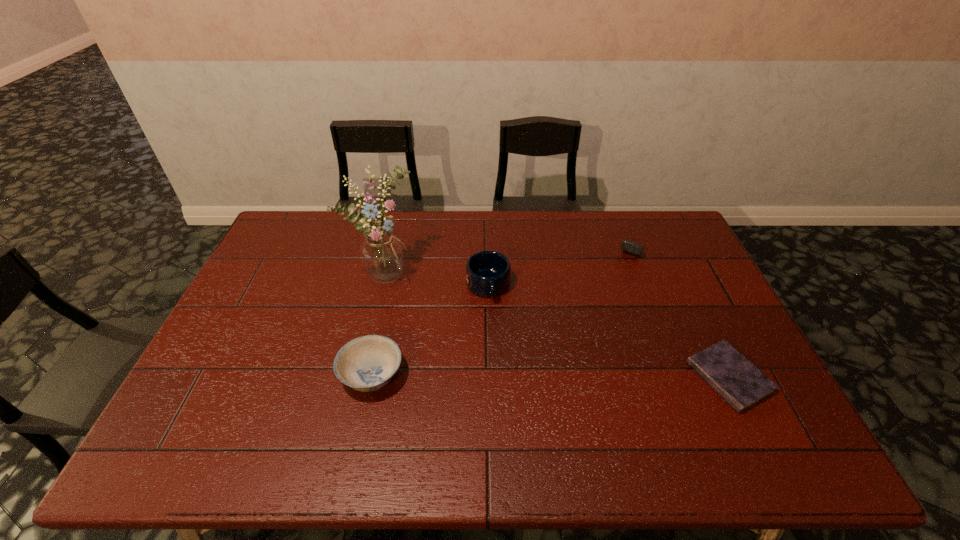
I want to click on diary present at the right edge, so click(741, 384).

Locate an element on the screen. This screenshot has width=960, height=540. webcam at the right edge is located at coordinates (634, 248).

I want to click on object that is at the far right corner, so click(x=634, y=248).

The image size is (960, 540). In order to click on object present at the near right corner in this screenshot , I will do `click(741, 384)`.

In the image, there is a desktop. Identify the location of vacant space at the far edge. (478, 232).

The height and width of the screenshot is (540, 960). In the image, there is a desktop. In order to click on free region at the near edge in this screenshot , I will do `click(304, 411)`.

What are the coordinates of `vacant region at the left edge of the desktop` in the screenshot? It's located at (228, 347).

This screenshot has width=960, height=540. What are the coordinates of `vacant space at the right edge of the desktop` in the screenshot? It's located at (660, 251).

At what (x,y) coordinates should I click in order to perform the action: click on vacant space at the near left corner. Please return your answer as a coordinate pair (x, y). Looking at the image, I should click on (187, 399).

You are a GUI agent. You are given a task and a screenshot of the screen. Output one action in this format:
    pyautogui.click(x=<x>, y=<y>)
    Task: Click on the blank space at the far right corner of the desktop
    The height and width of the screenshot is (540, 960).
    Given the screenshot: What is the action you would take?
    pyautogui.click(x=638, y=224)